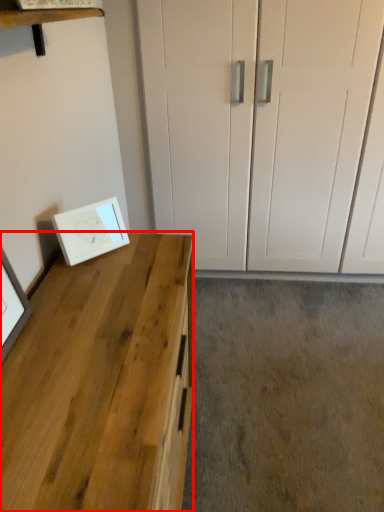
Question: From the image's perspective, where is desk (annotated by the red box) located relative to picture frame?

Choices:
 (A) above
 (B) below

Answer: (B)